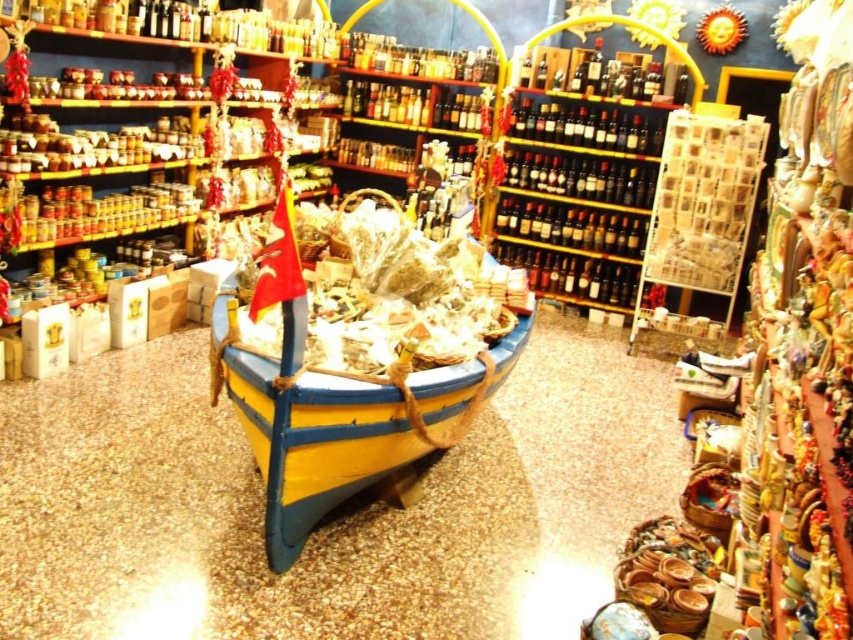
Question: Is yellow wood boat at center closer to the viewer compared to matte plastic bag at center?

Choices:
 (A) yes
 (B) no

Answer: (A)

Question: Based on their relative distances, which object is farther from the matte plastic bag at center?

Choices:
 (A) yellow wood boat at center
 (B) yellow painted wood boat at center

Answer: (A)

Question: Does yellow wood boat at center appear on the right side of matte plastic bag at center?

Choices:
 (A) yes
 (B) no

Answer: (A)

Question: Is yellow wood boat at center to the right of yellow painted wood boat at center from the viewer's perspective?

Choices:
 (A) yes
 (B) no

Answer: (A)

Question: Based on their relative distances, which object is farther from the yellow wood boat at center?

Choices:
 (A) matte plastic bag at center
 (B) yellow painted wood boat at center

Answer: (A)

Question: Which point is farther to the camera?

Choices:
 (A) matte plastic bag at center
 (B) yellow painted wood boat at center

Answer: (A)